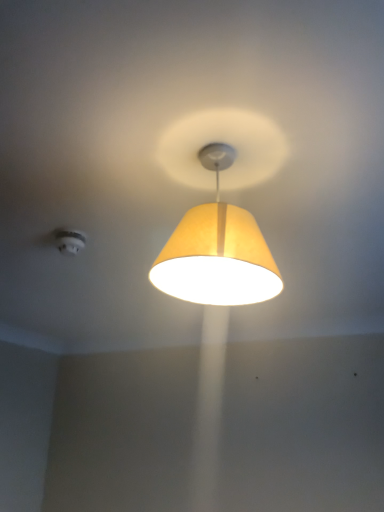
Question: From a real-world perspective, is white plastic smoke detector at upper left on matte yellow fabric lampshade at center?

Choices:
 (A) no
 (B) yes

Answer: (B)

Question: Does white plastic smoke detector at upper left have a larger size compared to matte yellow fabric lampshade at center?

Choices:
 (A) yes
 (B) no

Answer: (B)

Question: Is white plastic smoke detector at upper left thinner than matte yellow fabric lampshade at center?

Choices:
 (A) yes
 (B) no

Answer: (A)

Question: Is the position of white plastic smoke detector at upper left less distant than that of matte yellow fabric lampshade at center?

Choices:
 (A) yes
 (B) no

Answer: (B)

Question: From a real-world perspective, is white plastic smoke detector at upper left physically below matte yellow fabric lampshade at center?

Choices:
 (A) no
 (B) yes

Answer: (A)

Question: Does white plastic smoke detector at upper left have a greater height compared to matte yellow fabric lampshade at center?

Choices:
 (A) no
 (B) yes

Answer: (A)

Question: Is matte yellow fabric lampshade at center placed right next to white plastic smoke detector at upper left?

Choices:
 (A) no
 (B) yes

Answer: (A)

Question: Would you say matte yellow fabric lampshade at center is outside white plastic smoke detector at upper left?

Choices:
 (A) no
 (B) yes

Answer: (B)

Question: Does matte yellow fabric lampshade at center turn towards white plastic smoke detector at upper left?

Choices:
 (A) no
 (B) yes

Answer: (A)

Question: Does matte yellow fabric lampshade at center contain white plastic smoke detector at upper left?

Choices:
 (A) no
 (B) yes

Answer: (A)

Question: Does matte yellow fabric lampshade at center have a lesser height compared to white plastic smoke detector at upper left?

Choices:
 (A) no
 (B) yes

Answer: (A)

Question: Can you confirm if matte yellow fabric lampshade at center is positioned to the left of white plastic smoke detector at upper left?

Choices:
 (A) yes
 (B) no

Answer: (B)

Question: From a real-world perspective, is matte yellow fabric lampshade at center positioned above or below white plastic smoke detector at upper left?

Choices:
 (A) above
 (B) below

Answer: (B)